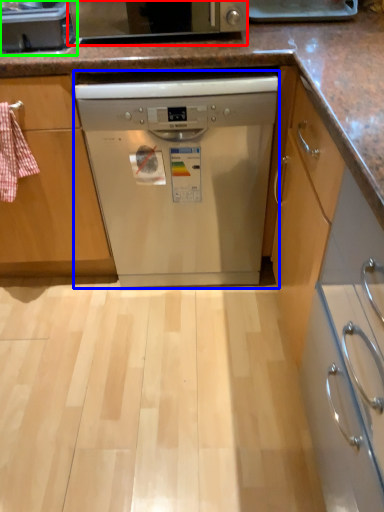
Question: Considering the real-world distances, which object is closest to home appliance (highlighted by a red box)? dishwasher (highlighted by a blue box) or kitchen appliance (highlighted by a green box).

Choices:
 (A) dishwasher
 (B) kitchen appliance

Answer: (B)